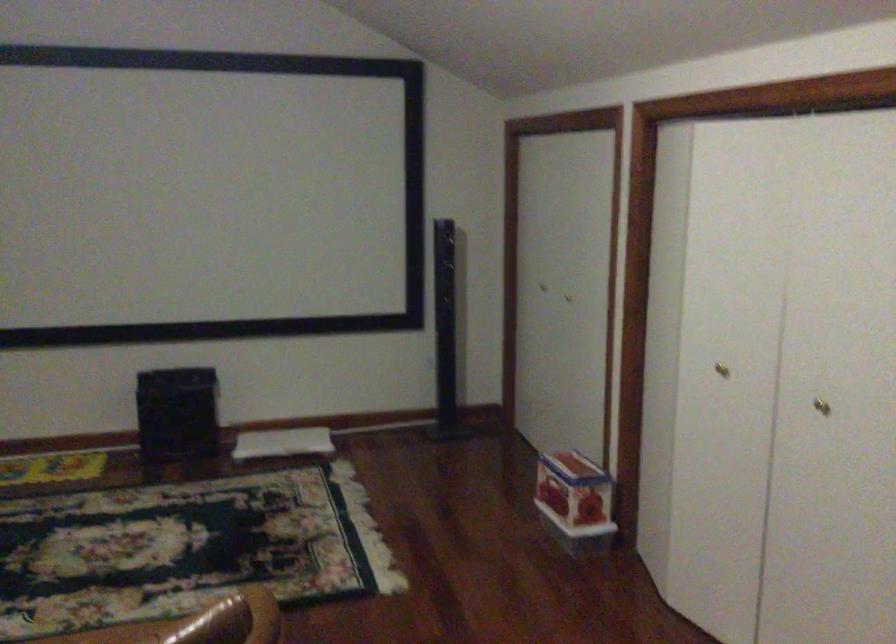
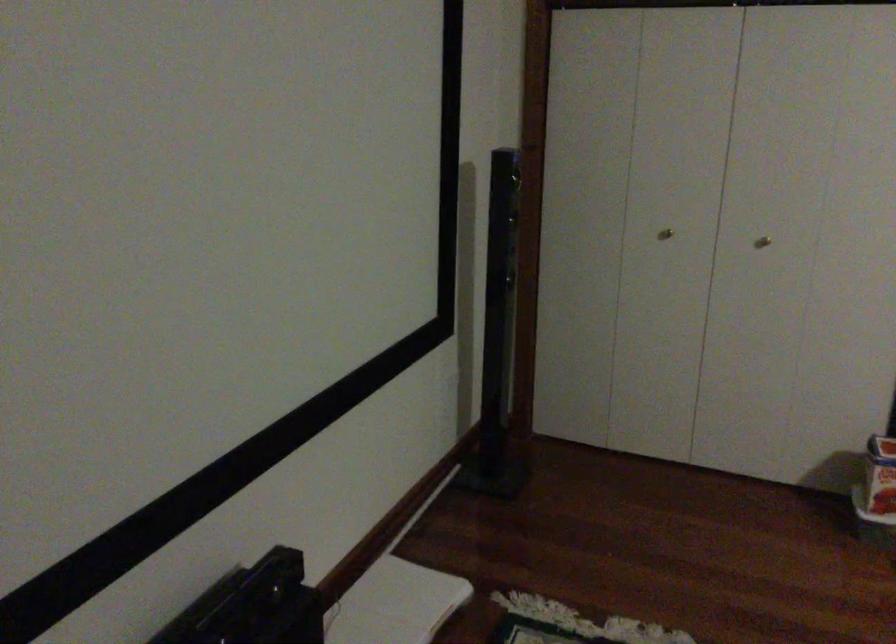
Where in the second image is the point corresponding to the point at 538,286 from the first image?

(665, 234)